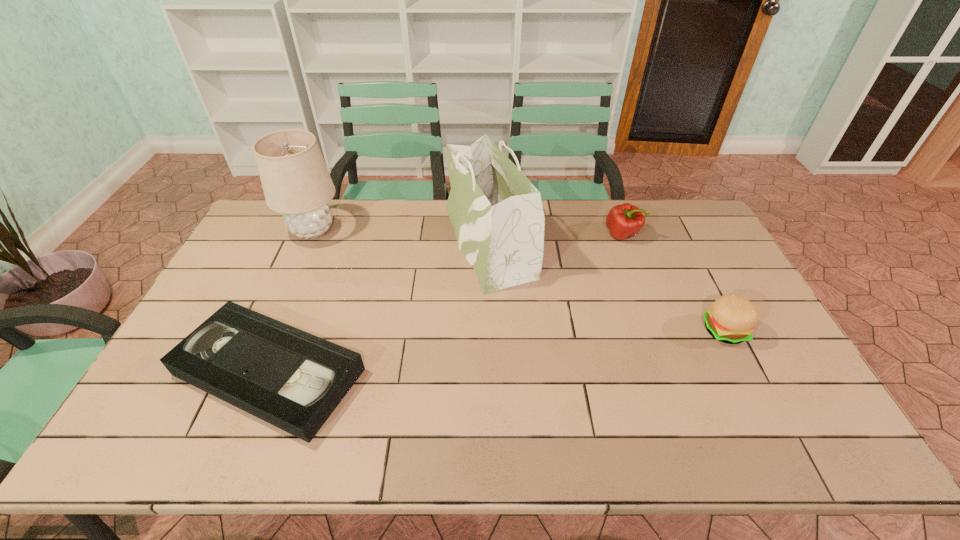
Image resolution: width=960 pixels, height=540 pixels. I want to click on free space that satisfies the following two spatial constraints: 1. on the front side of the grocery bag; 2. on the right side of the rightmost object, so 491,330.

At what (x,y) coordinates should I click in order to perform the action: click on vacant region that satisfies the following two spatial constraints: 1. on the front side of the shortest object; 2. on the right side of the lampshade. Please return your answer as a coordinate pair (x, y). The image size is (960, 540). Looking at the image, I should click on (x=251, y=372).

Identify the location of free space that satisfies the following two spatial constraints: 1. on the front side of the shortest object; 2. on the right side of the lampshade. The height and width of the screenshot is (540, 960). (251, 372).

Image resolution: width=960 pixels, height=540 pixels. Find the location of `free space that satisfies the following two spatial constraints: 1. on the front side of the third object from left to right; 2. on the right side of the hamburger`. free space that satisfies the following two spatial constraints: 1. on the front side of the third object from left to right; 2. on the right side of the hamburger is located at coordinates (491, 330).

At what (x,y) coordinates should I click in order to perform the action: click on vacant space that satisfies the following two spatial constraints: 1. on the back side of the fourth object from left to right; 2. on the left side of the third object from left to right. Please return your answer as a coordinate pair (x, y). This screenshot has height=540, width=960. Looking at the image, I should click on (489, 234).